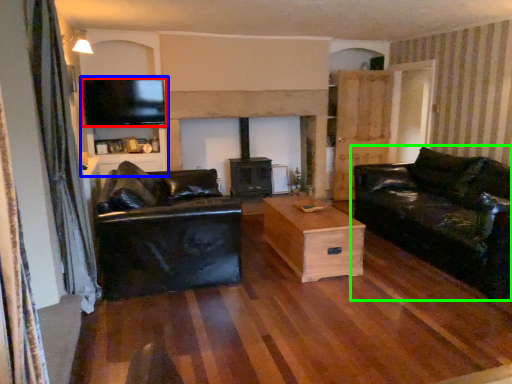
Question: Which is nearer to the television (highlighted by a red box)? entertainment center (highlighted by a blue box) or studio couch (highlighted by a green box).

Choices:
 (A) entertainment center
 (B) studio couch

Answer: (A)